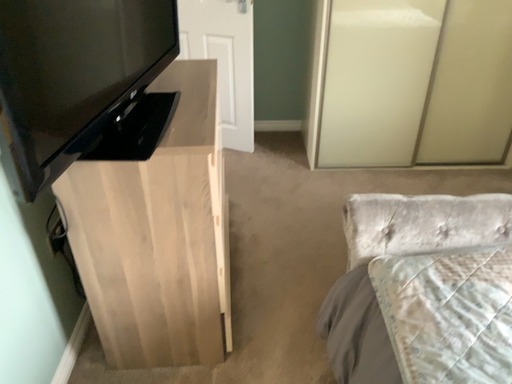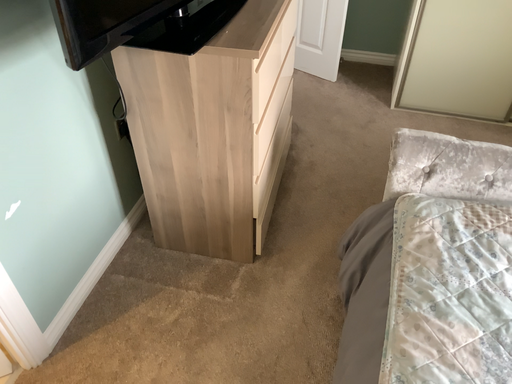
Question: How did the camera likely rotate when shooting the video?

Choices:
 (A) rotated downward
 (B) rotated upward

Answer: (A)